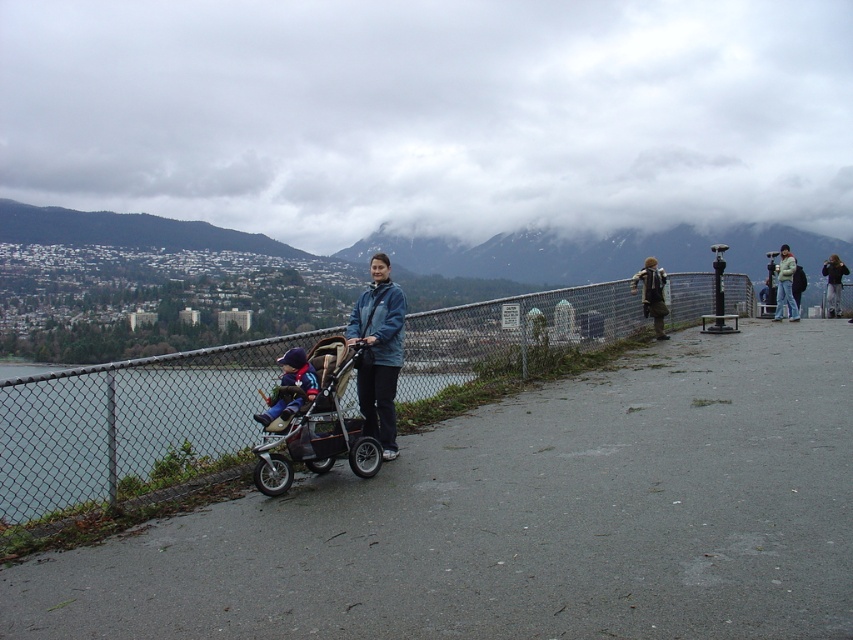
Is matte blue jacket at center to the left of blue fleece jacket at center from the viewer's perspective?

In fact, matte blue jacket at center is to the right of blue fleece jacket at center.

Does matte blue jacket at center have a lesser width compared to blue fleece jacket at center?

Incorrect, matte blue jacket at center's width is not less than blue fleece jacket at center's.

The height and width of the screenshot is (640, 853). Find the location of `matte blue jacket at center`. matte blue jacket at center is located at coordinates (378, 352).

Is point (676, 189) behind point (521, 579)?

That is True.

Which is more to the left, cloudy sky at upper center or smooth asphalt path at center?

cloudy sky at upper center

This screenshot has width=853, height=640. Find the location of `cloudy sky at upper center`. cloudy sky at upper center is located at coordinates (431, 115).

Is point (556, 397) positioned before point (383, 308)?

No, (556, 397) is further to viewer.

Does smooth asphalt path at center have a larger size compared to matte blue jacket at center?

Yes.

The image size is (853, 640). Identify the location of smooth asphalt path at center. (523, 518).

The width and height of the screenshot is (853, 640). In order to click on smooth asphalt path at center in this screenshot , I will do `click(523, 518)`.